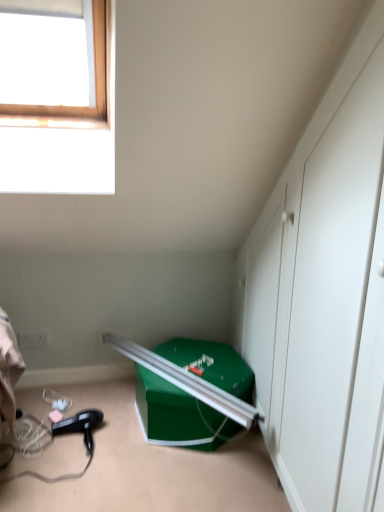
Locate an element on the screen. The image size is (384, 512). free location above green cardboard box at lower right (from a real-world perspective) is located at coordinates (198, 370).